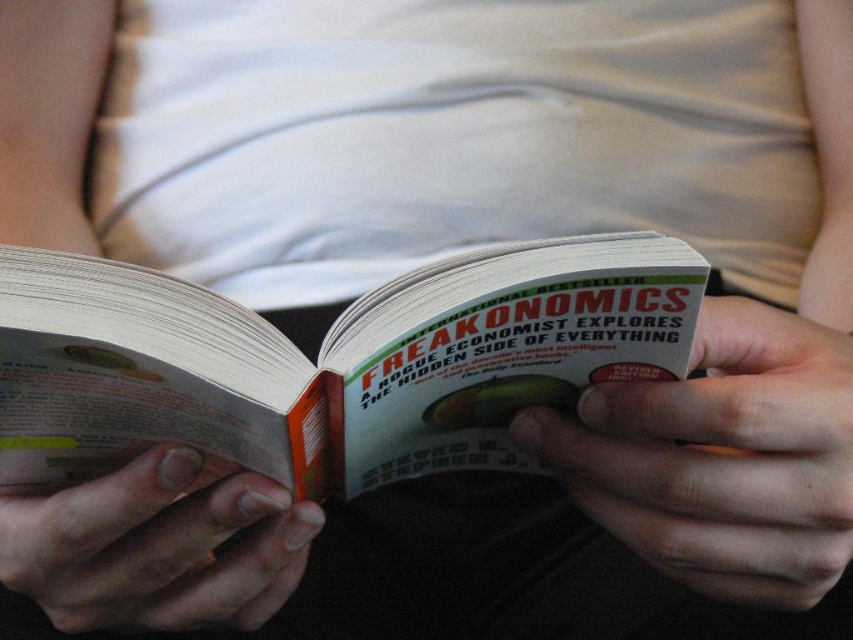
Question: Which object is positioned farthest from the smooth skin hand at lower left?

Choices:
 (A) smooth skin hand at center
 (B) white paper book at center

Answer: (A)

Question: Which point is farther from the camera taking this photo?

Choices:
 (A) (192, 509)
 (B) (700, 554)

Answer: (B)

Question: Is smooth skin hand at center to the right of smooth skin hand at lower left from the viewer's perspective?

Choices:
 (A) yes
 (B) no

Answer: (A)

Question: Which point is closer to the camera?

Choices:
 (A) (180, 417)
 (B) (646, 502)

Answer: (A)

Question: Does white paper book at center have a larger size compared to smooth skin hand at lower left?

Choices:
 (A) yes
 (B) no

Answer: (A)

Question: Does white paper book at center lie behind smooth skin hand at center?

Choices:
 (A) yes
 (B) no

Answer: (B)